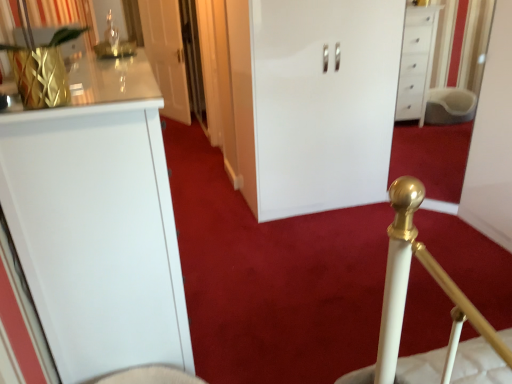
Question: Is white glossy cabinet at center, which appears as the first door when viewed from the front, to the left or to the right of white glossy door at upper center, the 2th door positioned from the front, in the image?

Choices:
 (A) right
 (B) left

Answer: (A)

Question: Is white glossy cabinet at center, which appears as the first door when viewed from the front, inside or outside of white glossy door at upper center, the 2th door in the right-to-left sequence?

Choices:
 (A) inside
 (B) outside

Answer: (B)

Question: Which of these objects is positioned farthest from the white glossy door at upper center, which appears as the first door when viewed from the left?

Choices:
 (A) gold metallic curtain at upper left
 (B) white glossy cabinet at center, which ranks as the 2th door in left-to-right order

Answer: (B)

Question: Which object is positioned closest to the white glossy cabinet at center, which ranks as the 2th door in left-to-right order?

Choices:
 (A) gold metallic curtain at upper left
 (B) white glossy door at upper center, the 2th door positioned from the front

Answer: (A)